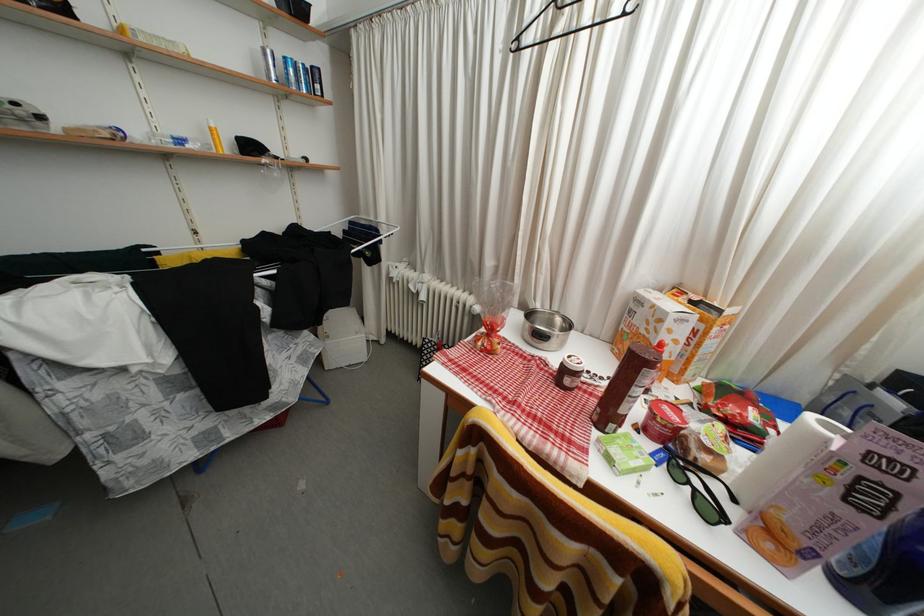
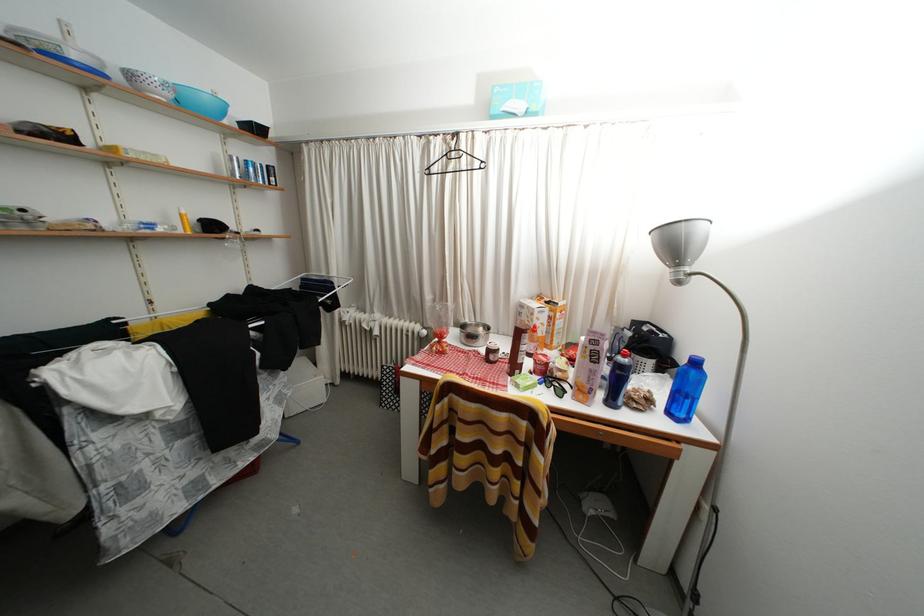
The point at (x=566, y=33) is marked in the first image. Where is the corresponding point in the second image?

(458, 172)